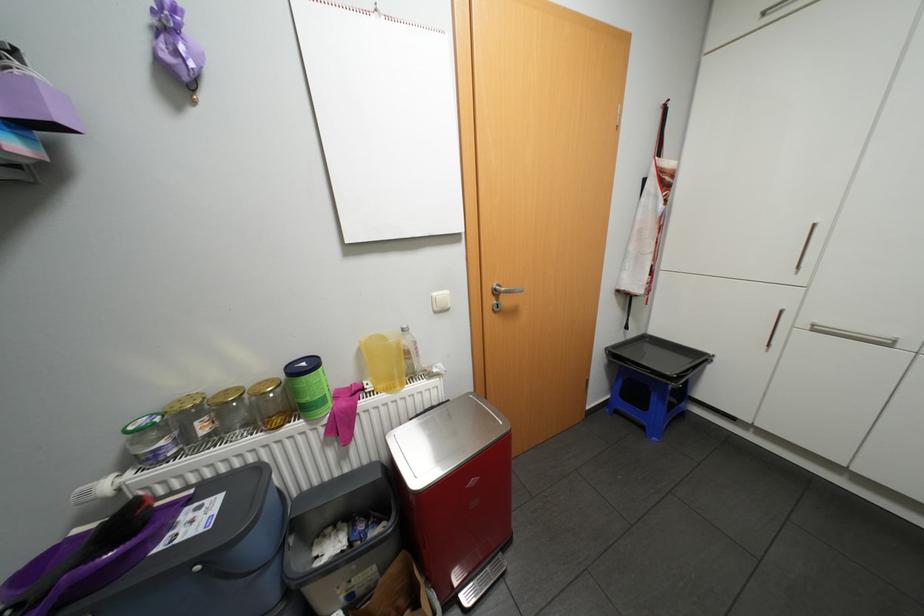
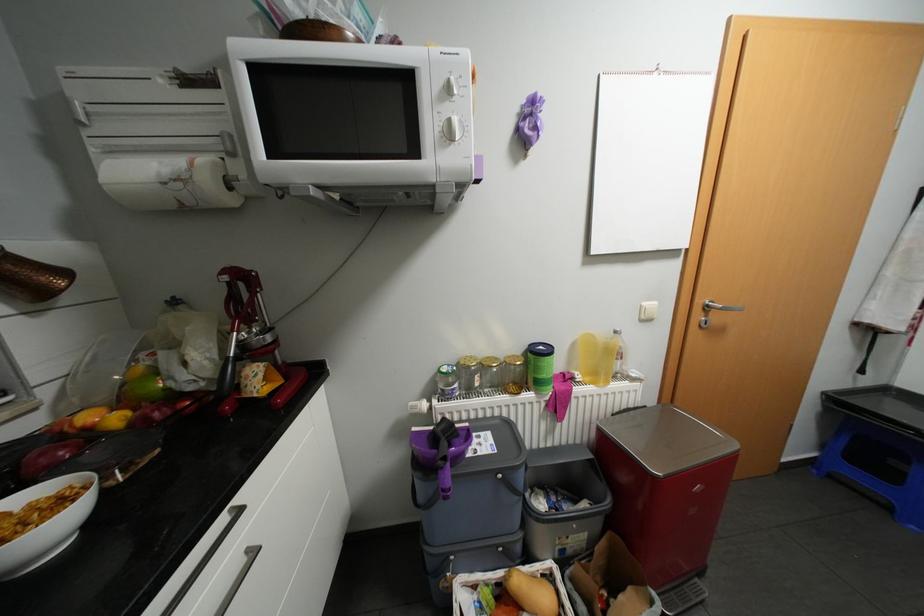
In the second image, find the point that corresponds to pixel 169 442 in the first image.

(464, 384)